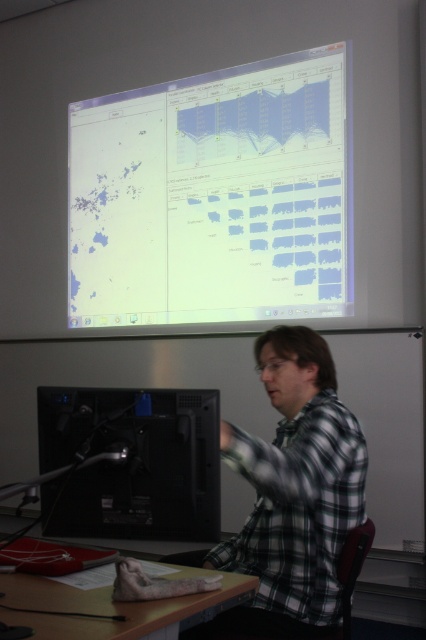
Who is shorter, white glossy screen at upper center or plaid fabric shirt at lower right?

plaid fabric shirt at lower right is shorter.

How far apart are white glossy screen at upper center and plaid fabric shirt at lower right?

A distance of 1.69 meters exists between white glossy screen at upper center and plaid fabric shirt at lower right.

Between point (146, 323) and point (311, 492), which one is positioned in front?

Point (311, 492)

You are a GUI agent. You are given a task and a screenshot of the screen. Output one action in this format:
    pyautogui.click(x=<x>, y=<y>)
    Task: Click on the white glossy screen at upper center
    The image size is (426, 640).
    Given the screenshot: What is the action you would take?
    pyautogui.click(x=213, y=196)

Is point (94, 275) positioned after point (141, 630)?

Yes, point (94, 275) is farther from viewer.

Which is in front, point (250, 86) or point (26, 598)?

Point (26, 598) is in front.

Who is more forward, [126,248] or [36,586]?

Point [36,586] is more forward.

Image resolution: width=426 pixels, height=640 pixels. I want to click on white glossy screen at upper center, so click(213, 196).

Between black matte computer at lower left and plaid fabric shirt at lower right, which one is positioned lower?

plaid fabric shirt at lower right

Between black matte computer at lower left and plaid fabric shirt at lower right, which one is positioned higher?

black matte computer at lower left is above.

Identify the location of black matte computer at lower left. This screenshot has width=426, height=640. (135, 461).